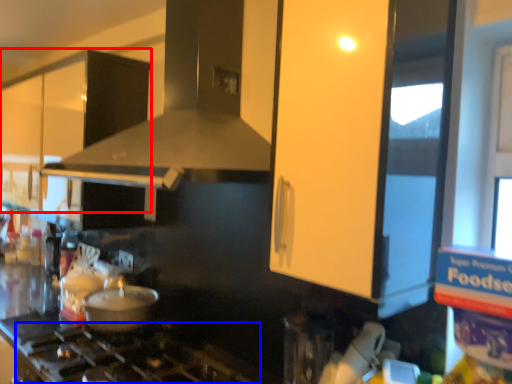
Question: Which point is further to the camera, cabinetry (highlighted by a red box) or gas stove (highlighted by a blue box)?

Choices:
 (A) cabinetry
 (B) gas stove

Answer: (A)